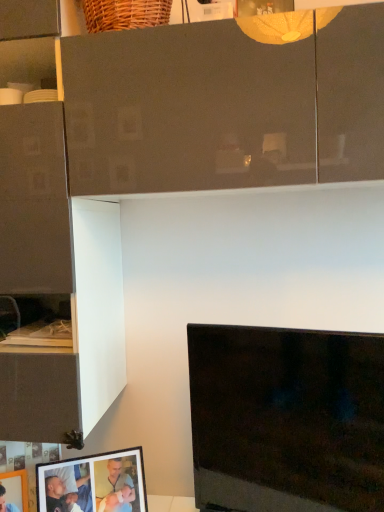
Question: Does black glossy tv at lower right have a greater height compared to matte black picture frame at lower left, placed as the second picture frame when sorted from right to left?

Choices:
 (A) yes
 (B) no

Answer: (A)

Question: From a real-world perspective, is black glossy tv at lower right on matte black picture frame at lower left, placed as the 1th picture frame when sorted from left to right?

Choices:
 (A) no
 (B) yes

Answer: (B)

Question: Is black glossy tv at lower right oriented towards matte black picture frame at lower left, placed as the second picture frame when sorted from right to left?

Choices:
 (A) no
 (B) yes

Answer: (A)

Question: Is black glossy tv at lower right positioned with its back to matte black picture frame at lower left, placed as the second picture frame when sorted from right to left?

Choices:
 (A) no
 (B) yes

Answer: (A)

Question: Can we say black glossy tv at lower right lies outside matte black picture frame at lower left, placed as the 1th picture frame when sorted from left to right?

Choices:
 (A) yes
 (B) no

Answer: (A)

Question: In terms of width, does matte black picture frame at lower left, marked as the 2th picture frame in a left-to-right arrangement, look wider or thinner when compared to matte black picture frame at lower left, placed as the 1th picture frame when sorted from left to right?

Choices:
 (A) thin
 (B) wide

Answer: (A)

Question: In the image, is matte black picture frame at lower left, marked as the 2th picture frame in a left-to-right arrangement, positioned in front of or behind matte black picture frame at lower left, placed as the 1th picture frame when sorted from left to right?

Choices:
 (A) front
 (B) behind

Answer: (B)

Question: Which is correct: matte black picture frame at lower left, arranged as the 1th picture frame when viewed from the right, is inside matte black picture frame at lower left, placed as the 1th picture frame when sorted from left to right, or outside of it?

Choices:
 (A) outside
 (B) inside

Answer: (A)

Question: Would you say matte black picture frame at lower left, arranged as the 1th picture frame when viewed from the right, is to the left or to the right of matte black picture frame at lower left, placed as the second picture frame when sorted from right to left, in the picture?

Choices:
 (A) left
 (B) right

Answer: (B)

Question: From the image's perspective, is black glossy tv at lower right above or below matte black picture frame at lower left, arranged as the 1th picture frame when viewed from the right?

Choices:
 (A) below
 (B) above

Answer: (B)

Question: Considering the positions of black glossy tv at lower right and matte black picture frame at lower left, arranged as the 1th picture frame when viewed from the right, in the image, is black glossy tv at lower right bigger or smaller than matte black picture frame at lower left, arranged as the 1th picture frame when viewed from the right,?

Choices:
 (A) big
 (B) small

Answer: (A)

Question: Relative to matte black picture frame at lower left, arranged as the 1th picture frame when viewed from the right, is black glossy tv at lower right in front or behind?

Choices:
 (A) front
 (B) behind

Answer: (A)

Question: In the image, is black glossy tv at lower right on the left side or the right side of matte black picture frame at lower left, marked as the 2th picture frame in a left-to-right arrangement?

Choices:
 (A) left
 (B) right

Answer: (B)

Question: Is matte black picture frame at lower left, placed as the second picture frame when sorted from right to left, in front of or behind black glossy tv at lower right in the image?

Choices:
 (A) front
 (B) behind

Answer: (B)

Question: In terms of width, does matte black picture frame at lower left, placed as the second picture frame when sorted from right to left, look wider or thinner when compared to black glossy tv at lower right?

Choices:
 (A) thin
 (B) wide

Answer: (A)